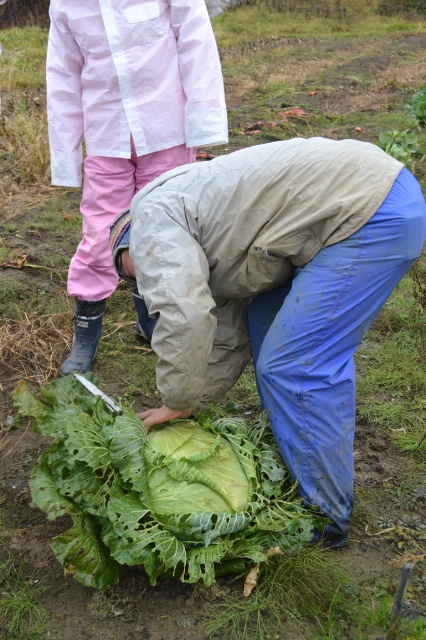
Is green leafy cabbage at center closer to camera compared to pink fabric pants at lower left?

Yes, green leafy cabbage at center is closer to the viewer.

Can you confirm if green leafy cabbage at center is smaller than pink fabric pants at lower left?

Yes.

Where is `green leafy cabbage at center`? This screenshot has width=426, height=640. green leafy cabbage at center is located at coordinates coord(158,488).

Identify the location of green leafy cabbage at center. (158, 488).

Does point (368, 225) come behind point (192, 90)?

No, (368, 225) is closer to viewer.

Which is behind, point (265, 202) or point (140, 35)?

The point (140, 35) is behind.

Where is `green leafy vegetable at center`? The height and width of the screenshot is (640, 426). green leafy vegetable at center is located at coordinates 273,289.

Can you confirm if green leafy vegetable at center is positioned above green leafy cabbage at center?

Correct, green leafy vegetable at center is located above green leafy cabbage at center.

The image size is (426, 640). What do you see at coordinates (273, 289) in the screenshot?
I see `green leafy vegetable at center` at bounding box center [273, 289].

Is point (184, 266) farther from viewer compared to point (51, 397)?

No.

In order to click on green leafy vegetable at center in this screenshot , I will do `click(273, 289)`.